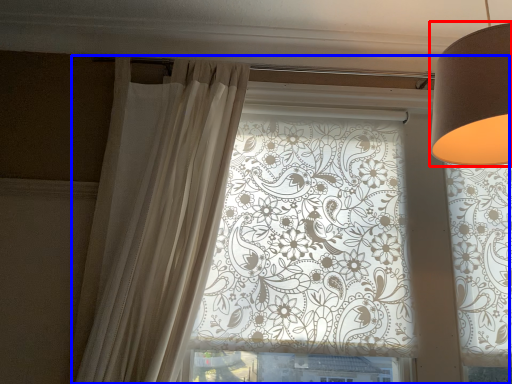
Question: Among these objects, which one is farthest to the camera, lamp (highlighted by a red box) or window (highlighted by a blue box)?

Choices:
 (A) lamp
 (B) window

Answer: (B)